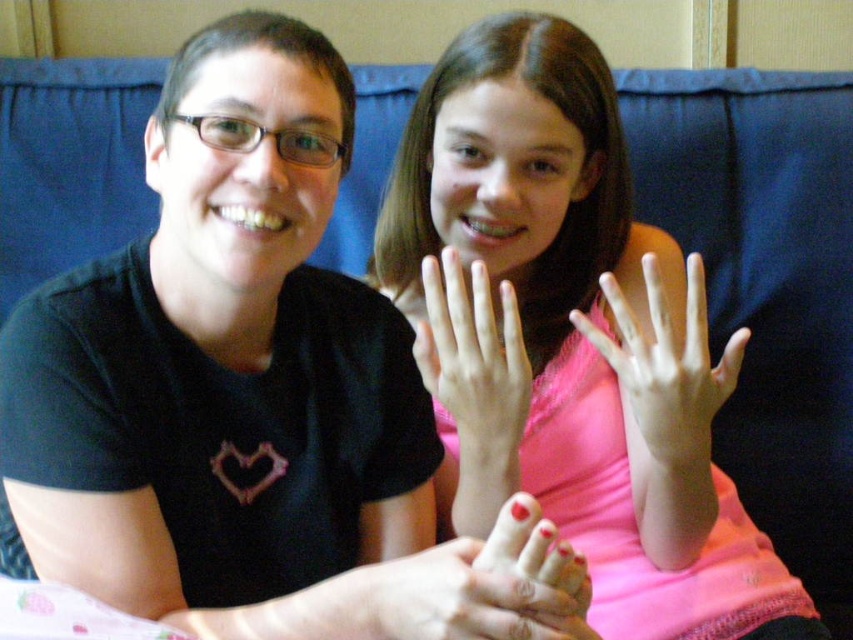
Question: Which of the following is the closest to the observer?

Choices:
 (A) pink matte nails at center
 (B) pink matte shirt at upper center

Answer: (B)

Question: Among these objects, which one is nearest to the camera?

Choices:
 (A) pink matte hand at center
 (B) pale skin hand at center
 (C) smooth painted nail at center

Answer: (C)

Question: Does smooth painted nail at center have a lesser width compared to pink matte hand at center?

Choices:
 (A) no
 (B) yes

Answer: (A)

Question: Is smooth painted nail at center wider than pink matte hand at center?

Choices:
 (A) yes
 (B) no

Answer: (A)

Question: From the image, what is the correct spatial relationship of smooth painted nail at center in relation to pink matte hand at center?

Choices:
 (A) right
 (B) left

Answer: (B)

Question: Which point is farther from the camera taking this photo?

Choices:
 (A) (628, 307)
 (B) (560, 620)

Answer: (A)